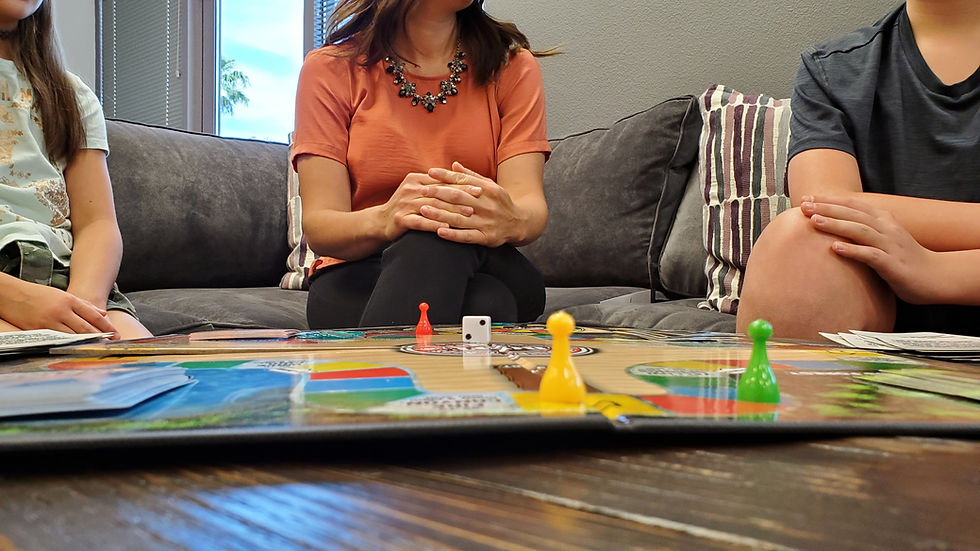
At what (x,y) coordinates should I click in order to perform the action: click on window. Please return your answer as a coordinate pair (x, y). Looking at the image, I should click on (254, 33).